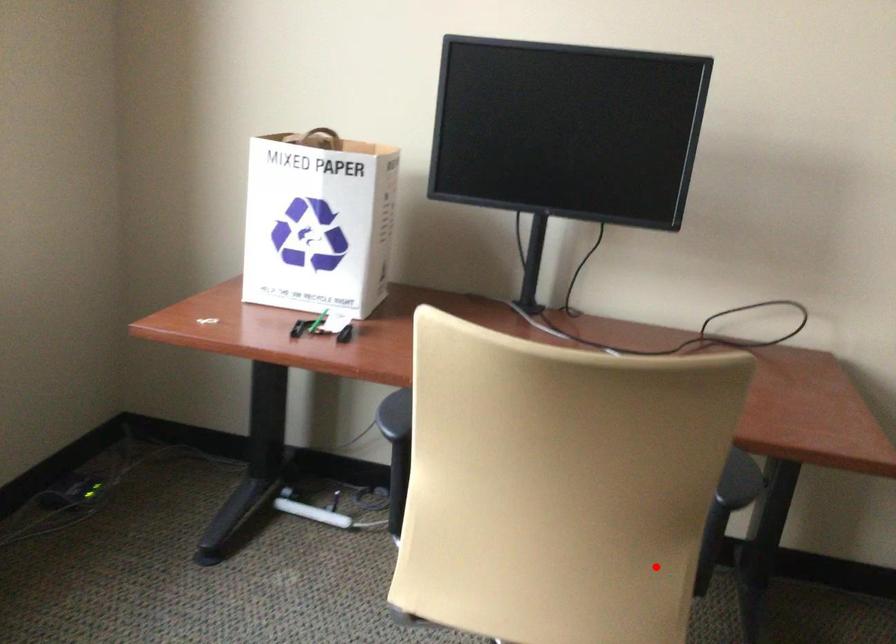
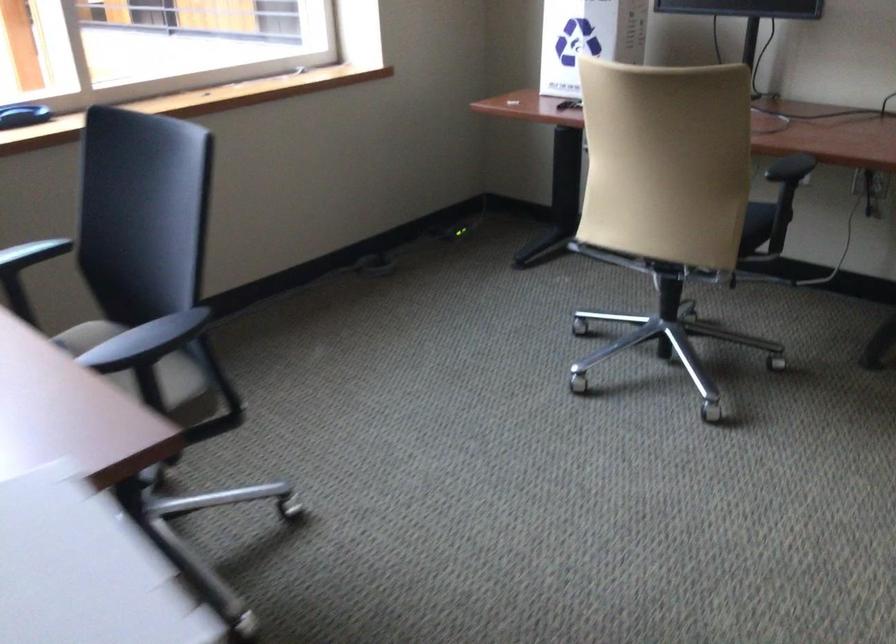
Question: A red point is marked in image1. In image2, is the corresponding 3D point closer to the camera or farther? Reply with the corresponding letter.

Choices:
 (A) The corresponding 3D point is closer.
 (B) The corresponding 3D point is farther.

Answer: (B)